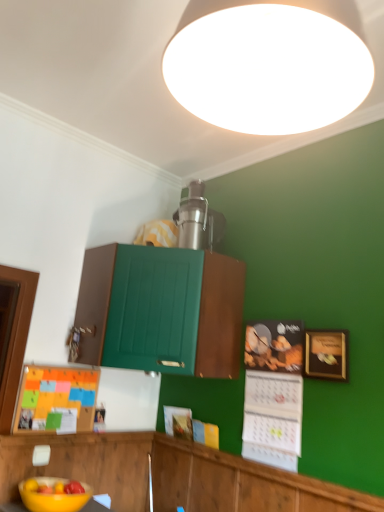
Identify the location of yellow matte bowl at lower left. This screenshot has height=512, width=384. (52, 496).

Find the location of `white matte ceiling light at upper center`. white matte ceiling light at upper center is located at coordinates (269, 63).

The image size is (384, 512). What do you see at coordinates (97, 505) in the screenshot?
I see `yellow matte bowl at lower left` at bounding box center [97, 505].

Describe the element at coordinates (56, 398) in the screenshot. I see `burlap bulletin board at lower left, the 2th bulletin board positioned from the right` at that location.

Measure the distance between wooden cabinet at lower center, the 1th cabinetry ordered from the bottom, and camera.

They are 4.79 feet apart.

You are a GUI agent. You are given a task and a screenshot of the screen. Output one action in this format:
    pyautogui.click(x=<x>, y=<y>)
    Task: Click on the yellow matte bowl at lower left
    
    Given the screenshot: What is the action you would take?
    pyautogui.click(x=52, y=496)

From a real-world perspective, who is located higher, green matte cabinet at center, placed as the 2th cabinetry when sorted from bottom to top, or white matte ceiling light at upper center?

white matte ceiling light at upper center, from a real-world perspective.

Between green matte cabinet at center, arranged as the 1th cabinetry when viewed from the top, and white matte ceiling light at upper center, which one has larger width?

Wider between the two is green matte cabinet at center, arranged as the 1th cabinetry when viewed from the top.

Based on the photo, is green matte cabinet at center, arranged as the 1th cabinetry when viewed from the top, far away from white matte ceiling light at upper center?

Absolutely, green matte cabinet at center, arranged as the 1th cabinetry when viewed from the top, is distant from white matte ceiling light at upper center.

Considering the points (86, 264) and (308, 120), which point is behind, point (86, 264) or point (308, 120)?

The point (86, 264) is farther.

Is gold-framed picture at right looking in the opposite direction of yellow matte bowl at lower left?

gold-framed picture at right does not have its back to yellow matte bowl at lower left.

From the image's perspective, relative to yellow matte bowl at lower left, is gold-framed picture at right above or below?

gold-framed picture at right is situated higher than yellow matte bowl at lower left in the image.

Does gold-framed picture at right have a larger size compared to yellow matte bowl at lower left?

Incorrect, gold-framed picture at right is not larger than yellow matte bowl at lower left.

Based on the photo, what's the angular difference between gold-framed picture at right and yellow matte bowl at lower left's facing directions?

The angular difference between gold-framed picture at right and yellow matte bowl at lower left is 87.9 degrees.

Is burlap bulletin board at lower left, acting as the 1th bulletin board starting from the left, taller than wooden cabinet at lower center, the 1th cabinetry ordered from the bottom?

Incorrect, the height of burlap bulletin board at lower left, acting as the 1th bulletin board starting from the left, is not larger of that of wooden cabinet at lower center, the 1th cabinetry ordered from the bottom.

Based on the photo, between burlap bulletin board at lower left, acting as the 1th bulletin board starting from the left, and wooden cabinet at lower center, the 1th cabinetry ordered from the bottom, which one has larger width?

Wider between the two is wooden cabinet at lower center, the 1th cabinetry ordered from the bottom.

From a real-world perspective, relative to wooden cabinet at lower center, placed as the 2th cabinetry when sorted from top to bottom, is burlap bulletin board at lower left, the 2th bulletin board positioned from the right, vertically above or below?

burlap bulletin board at lower left, the 2th bulletin board positioned from the right, is above wooden cabinet at lower center, placed as the 2th cabinetry when sorted from top to bottom.

Does point (80, 412) appear closer or farther from the camera than point (173, 444)?

Point (80, 412) is positioned closer to the camera compared to point (173, 444).

Considering the relative sizes of green matte cabinet at center, arranged as the 1th cabinetry when viewed from the top, and matte black calendar at lower right, the second bulletin board viewed from the left, in the image provided, is green matte cabinet at center, arranged as the 1th cabinetry when viewed from the top, bigger than matte black calendar at lower right, the second bulletin board viewed from the left,?

Yes.

In the scene shown: From the image's perspective, is green matte cabinet at center, placed as the 2th cabinetry when sorted from bottom to top, over matte black calendar at lower right, the second bulletin board viewed from the left?

Correct, green matte cabinet at center, placed as the 2th cabinetry when sorted from bottom to top, appears higher than matte black calendar at lower right, the second bulletin board viewed from the left, in the image.

Is green matte cabinet at center, placed as the 2th cabinetry when sorted from bottom to top, oriented away from matte black calendar at lower right, the second bulletin board viewed from the left?

No, green matte cabinet at center, placed as the 2th cabinetry when sorted from bottom to top, is not facing away from matte black calendar at lower right, the second bulletin board viewed from the left.

Considering the relative sizes of green matte cabinet at center, placed as the 2th cabinetry when sorted from bottom to top, and matte black calendar at lower right, acting as the 1th bulletin board starting from the right, in the image provided, is green matte cabinet at center, placed as the 2th cabinetry when sorted from bottom to top, thinner than matte black calendar at lower right, acting as the 1th bulletin board starting from the right,?

No, green matte cabinet at center, placed as the 2th cabinetry when sorted from bottom to top, is not thinner than matte black calendar at lower right, acting as the 1th bulletin board starting from the right.

From a real-world perspective, between gold-framed picture at right and yellow matte bowl at lower left, who is vertically lower?

yellow matte bowl at lower left.

From the picture: Considering the relative sizes of gold-framed picture at right and yellow matte bowl at lower left in the image provided, is gold-framed picture at right taller than yellow matte bowl at lower left?

Yes, gold-framed picture at right is taller than yellow matte bowl at lower left.

Measure the distance between gold-framed picture at right and yellow matte bowl at lower left.

gold-framed picture at right and yellow matte bowl at lower left are 3.83 feet apart.

How different are the orientations of gold-framed picture at right and yellow matte bowl at lower left in degrees?

They differ by 88.8 degrees in their facing directions.

Which object is closer to the camera, yellow matte bowl at lower left or white matte ceiling light at upper center?

white matte ceiling light at upper center.

How many degrees apart are the facing directions of yellow matte bowl at lower left and white matte ceiling light at upper center?

There is a 177-degree angle between the facing directions of yellow matte bowl at lower left and white matte ceiling light at upper center.

Is yellow matte bowl at lower left wider or thinner than white matte ceiling light at upper center?

yellow matte bowl at lower left is wider than white matte ceiling light at upper center.

Is yellow matte bowl at lower left aimed at white matte ceiling light at upper center?

No, yellow matte bowl at lower left is not aimed at white matte ceiling light at upper center.

Consider the image. Considering the positions of objects burlap bulletin board at lower left, the 2th bulletin board positioned from the right, and gold-framed picture at right in the image provided, who is more to the right, burlap bulletin board at lower left, the 2th bulletin board positioned from the right, or gold-framed picture at right?

gold-framed picture at right is more to the right.

Can you see burlap bulletin board at lower left, the 2th bulletin board positioned from the right, touching gold-framed picture at right?

No, burlap bulletin board at lower left, the 2th bulletin board positioned from the right, is not next to gold-framed picture at right.

From the image's perspective, which one is positioned lower, burlap bulletin board at lower left, the 2th bulletin board positioned from the right, or gold-framed picture at right?

burlap bulletin board at lower left, the 2th bulletin board positioned from the right.

Looking at this image, between burlap bulletin board at lower left, the 2th bulletin board positioned from the right, and gold-framed picture at right, which one has larger width?

gold-framed picture at right is wider.

At what (x,y) coordinates should I click in order to perform the action: click on lamp above the green matte cabinet at center, placed as the 2th cabinetry when sorted from bottom to top (from a real-world perspective). Please return your answer as a coordinate pair (x, y). Looking at the image, I should click on (269, 63).

This screenshot has height=512, width=384. I want to click on table on the left of gold-framed picture at right, so click(x=97, y=505).

Based on their spatial positions, is burlap bulletin board at lower left, acting as the 1th bulletin board starting from the left, or green matte cabinet at center, arranged as the 1th cabinetry when viewed from the top, closer to white matte ceiling light at upper center?

Among the two, green matte cabinet at center, arranged as the 1th cabinetry when viewed from the top, is located nearer to white matte ceiling light at upper center.

Looking at the image, which one is located further to matte black calendar at lower right, the second bulletin board viewed from the left, yellow matte bowl at lower left or white matte ceiling light at upper center?

white matte ceiling light at upper center.

Which object lies nearer to the anchor point matte black calendar at lower right, the second bulletin board viewed from the left, green matte cabinet at center, placed as the 2th cabinetry when sorted from bottom to top, or wooden cabinet at lower center, placed as the 2th cabinetry when sorted from top to bottom?

wooden cabinet at lower center, placed as the 2th cabinetry when sorted from top to bottom, lies closer to matte black calendar at lower right, the second bulletin board viewed from the left, than the other object.

From the image, which object appears to be farther from gold-framed picture at right, white matte ceiling light at upper center or burlap bulletin board at lower left, acting as the 1th bulletin board starting from the left?

white matte ceiling light at upper center is further to gold-framed picture at right.

Based on their spatial positions, is yellow matte bowl at lower left or matte black calendar at lower right, acting as the 1th bulletin board starting from the right, further from burlap bulletin board at lower left, the 2th bulletin board positioned from the right?

matte black calendar at lower right, acting as the 1th bulletin board starting from the right, lies further to burlap bulletin board at lower left, the 2th bulletin board positioned from the right, than the other object.

Which object lies further to the anchor point yellow matte bowl at lower left, matte black calendar at lower right, acting as the 1th bulletin board starting from the right, or gold-framed picture at right?

gold-framed picture at right lies further to yellow matte bowl at lower left than the other object.

When comparing their distances from wooden cabinet at lower center, the 1th cabinetry ordered from the bottom, does white matte ceiling light at upper center or matte black calendar at lower right, acting as the 1th bulletin board starting from the right, seem closer?

matte black calendar at lower right, acting as the 1th bulletin board starting from the right, lies closer to wooden cabinet at lower center, the 1th cabinetry ordered from the bottom, than the other object.

Estimate the real-world distances between objects in this image. Which object is further from white matte ceiling light at upper center, burlap bulletin board at lower left, the 2th bulletin board positioned from the right, or yellow matte bowl at lower left?

yellow matte bowl at lower left is further to white matte ceiling light at upper center.

Where is `bowl that lies between green matte cabinet at center, placed as the 2th cabinetry when sorted from bottom to top, and wooden cabinet at lower center, placed as the 2th cabinetry when sorted from top to bottom, from top to bottom`? The image size is (384, 512). bowl that lies between green matte cabinet at center, placed as the 2th cabinetry when sorted from bottom to top, and wooden cabinet at lower center, placed as the 2th cabinetry when sorted from top to bottom, from top to bottom is located at coordinates (52, 496).

This screenshot has width=384, height=512. I want to click on table between yellow matte bowl at lower left and matte black calendar at lower right, acting as the 1th bulletin board starting from the right, in the horizontal direction, so click(x=97, y=505).

This screenshot has width=384, height=512. I want to click on bowl between white matte ceiling light at upper center and burlap bulletin board at lower left, the 2th bulletin board positioned from the right, along the z-axis, so click(52, 496).

Where is `picture frame between white matte ceiling light at upper center and green matte cabinet at center, placed as the 2th cabinetry when sorted from bottom to top, along the z-axis`? The width and height of the screenshot is (384, 512). picture frame between white matte ceiling light at upper center and green matte cabinet at center, placed as the 2th cabinetry when sorted from bottom to top, along the z-axis is located at coordinates (326, 354).